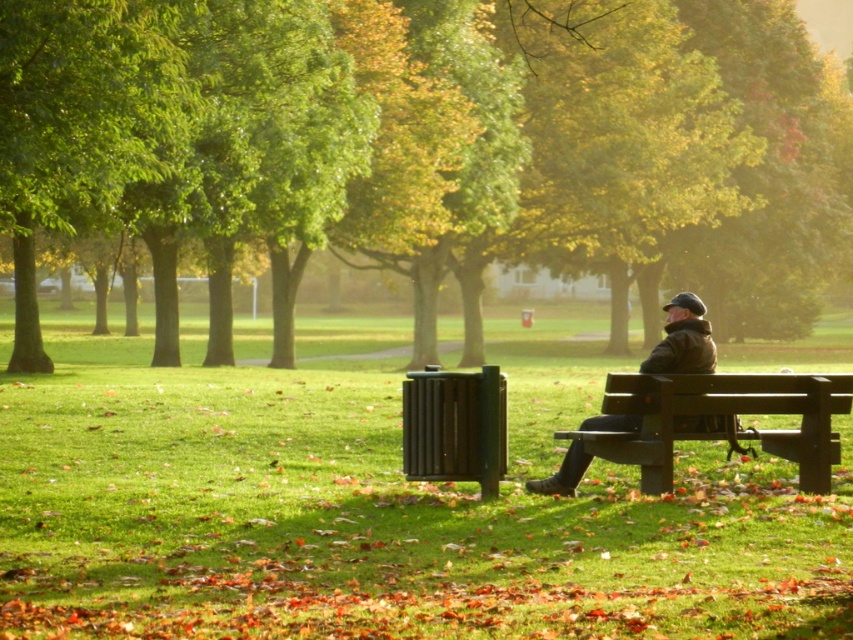
You are a park visitor who wants to sit on the wooden bench at right. There is a dark brown leather jacket at center. Is the jacket blocking your path to the bench?

The wooden bench at right is in front of the dark brown leather jacket at center, so the jacket is behind the bench and not blocking your path.

Consider the image. You are a delivery person carrying a package that is 20 inches long. You need to place it between the wooden bench at right and the dark brown leather jacket at center without moving either. Is there enough space?

The wooden bench at right and dark brown leather jacket at center are 21.26 inches apart, so yes, the package that is 20 inches long can fit between them since the space is slightly larger than the package.